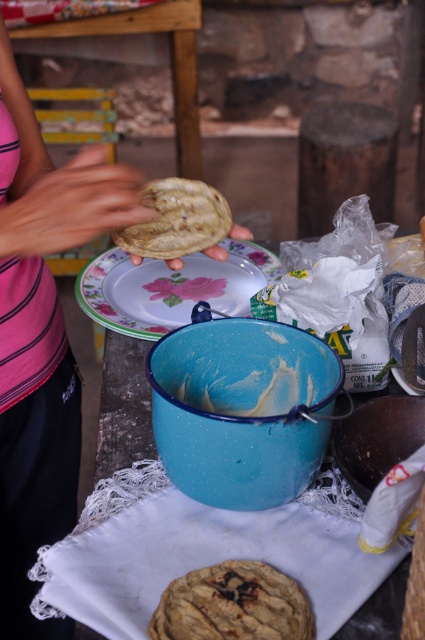
What do you see at coordinates (71, 205) in the screenshot?
I see `pink fabric hand at upper left` at bounding box center [71, 205].

Between pink fabric hand at upper left and golden textured biscuit at center, which one has more height?

pink fabric hand at upper left is taller.

Is point (115, 202) more distant than point (283, 634)?

Yes, it is.

Locate an element on the screen. pink fabric hand at upper left is located at coordinates (71, 205).

Who is lower down, blue enamel bowl at center or white glossy plate at center?

blue enamel bowl at center

Looking at this image, measure the distance between blue enamel bowl at center and camera.

blue enamel bowl at center and camera are 21.42 inches apart.

At what (x,y) coordinates should I click in order to perform the action: click on blue enamel bowl at center. Please return your answer as a coordinate pair (x, y). Looking at the image, I should click on (241, 410).

Is pink fabric shirt at upper left above white glossy plate at center?

No, pink fabric shirt at upper left is not above white glossy plate at center.

Who is lower down, pink fabric shirt at upper left or white glossy plate at center?

pink fabric shirt at upper left

Is point (74, 381) more distant than point (189, 282)?

No, (74, 381) is in front of (189, 282).

Where is `pink fabric shirt at upper left`? pink fabric shirt at upper left is located at coordinates (x=42, y=337).